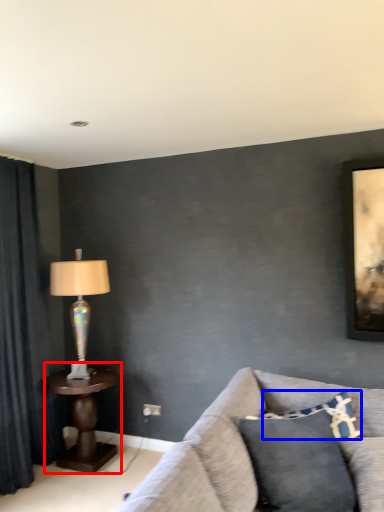
Question: Among these objects, which one is nearest to the camera, table (highlighted by a red box) or pillow (highlighted by a blue box)?

Choices:
 (A) table
 (B) pillow

Answer: (B)